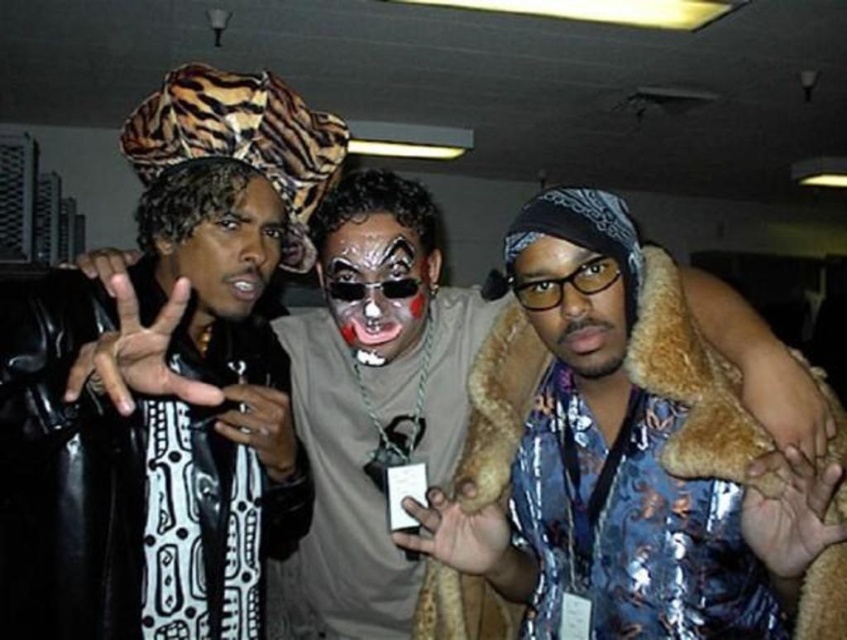
You are a photographer at this event and want to ensure both the matte black face paint at center and the shiny metallic face at center are clearly visible in your photo. Given their positions, which face should you focus on to capture both effectively?

The shiny metallic face at center is behind the matte black face paint at center. To capture both clearly, focus on the matte black face paint at center since it is closer to the camera, and the shiny metallic face at center will still be in focus due to its position behind.

Looking at this image, you are a photographer standing 5 feet away from the matte black face paint at center. Can you adjust your position to get a closer shot without moving the subject?

The distance between the matte black face paint at center and the camera is 4.09 feet. Since you are currently 5 feet away, you can move 0.91 feet closer to achieve a closer shot without moving the subject.

You are a photographer in the room and want to take a photo of both the shiny metallic face at center and the matte black face at center. Which one is closer to the camera?

The shiny metallic face at center is positioned under the matte black face at center, so the matte black face at center is closer to the camera.